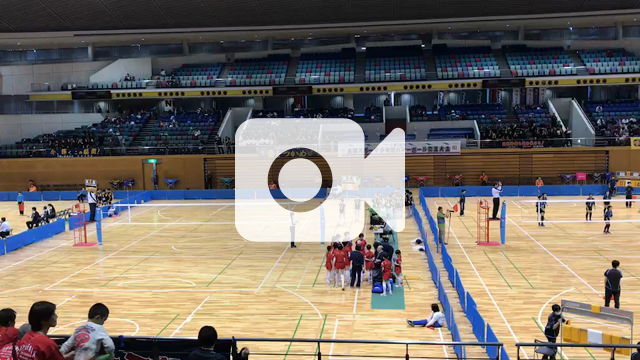
You are a GUI agent. You are given a task and a screenshot of the screen. Output one action in this format:
    pyautogui.click(x=<x>, y=<y>)
    Task: Click on the ceiling
    The height and width of the screenshot is (360, 640).
    Given the screenshot: What is the action you would take?
    pyautogui.click(x=172, y=16)